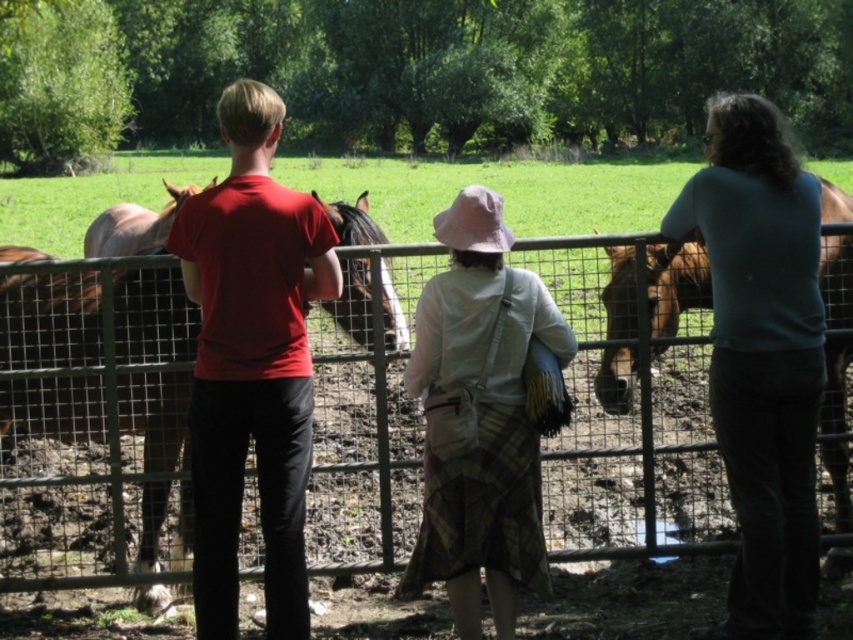
Question: Can you confirm if metal wire fence at center is positioned above matte red t-shirt at center?

Choices:
 (A) yes
 (B) no

Answer: (B)

Question: Which point appears farthest from the camera in this image?

Choices:
 (A) coord(593,444)
 (B) coord(267,541)
 (C) coord(838,202)
 (D) coord(498,381)

Answer: (A)

Question: Among these points, which one is farthest from the camera?

Choices:
 (A) (299, 243)
 (B) (22, 570)
 (C) (821, 198)

Answer: (B)

Question: Can you confirm if metal wire fence at center is positioned above matte red t-shirt at center?

Choices:
 (A) yes
 (B) no

Answer: (B)

Question: Which point is farther to the camera?

Choices:
 (A) (614, 410)
 (B) (262, 560)

Answer: (B)

Question: Does plaid fabric skirt at center lie behind brown glossy horse at right?

Choices:
 (A) no
 (B) yes

Answer: (A)